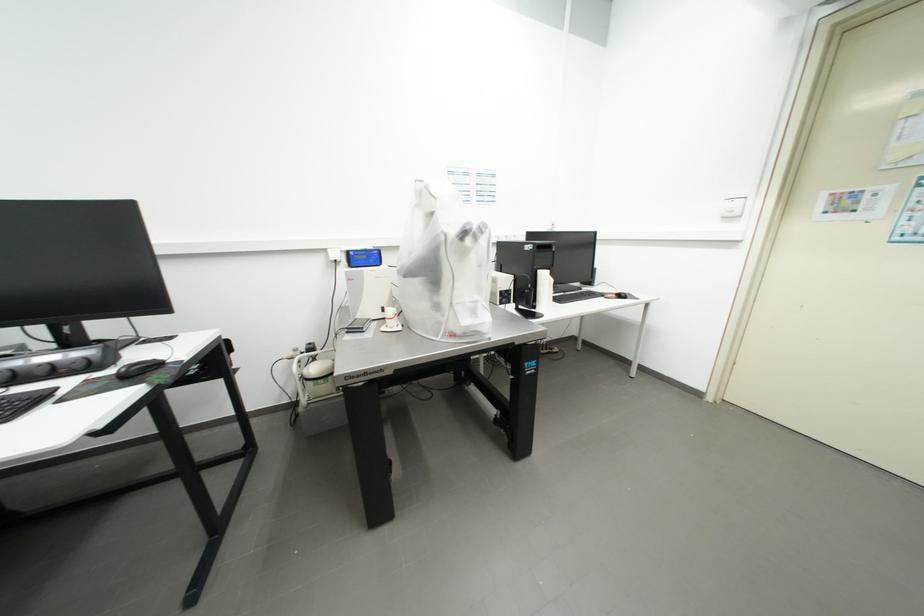
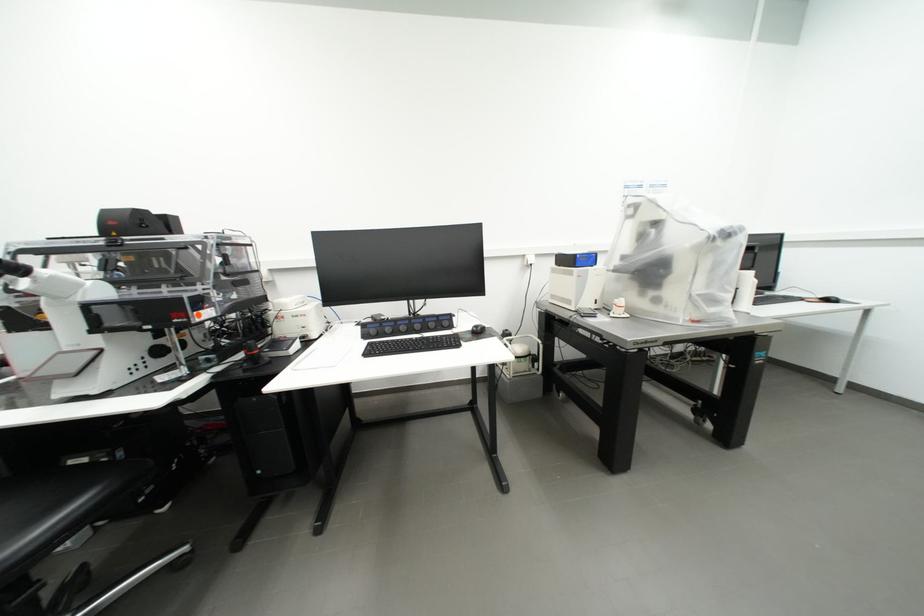
Which direction would the cameraman need to move to produce the second image?

The cameraman moved toward left, backward.